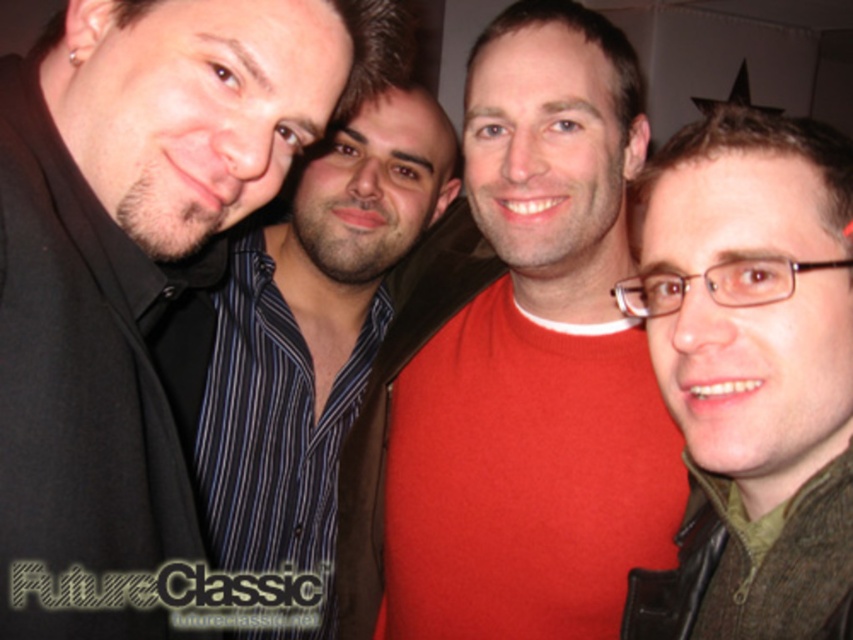
Question: Which is farther from the red matte shirt at center?

Choices:
 (A) green wool sweater at right
 (B) striped shirt at center

Answer: (A)

Question: Among these points, which one is nearest to the camera?

Choices:
 (A) (310, 248)
 (B) (59, 260)

Answer: (B)

Question: Observing the image, what is the correct spatial positioning of red matte shirt at center in reference to green wool sweater at right?

Choices:
 (A) above
 (B) below

Answer: (A)

Question: Can you confirm if green wool sweater at right is positioned to the right of striped shirt at center?

Choices:
 (A) no
 (B) yes

Answer: (B)

Question: From the image, what is the correct spatial relationship of red matte shirt at center in relation to green wool sweater at right?

Choices:
 (A) below
 (B) above

Answer: (B)

Question: Estimate the real-world distances between objects in this image. Which object is closer to the green wool sweater at right?

Choices:
 (A) red matte shirt at center
 (B) matte black shirt at left
 (C) striped shirt at center

Answer: (A)